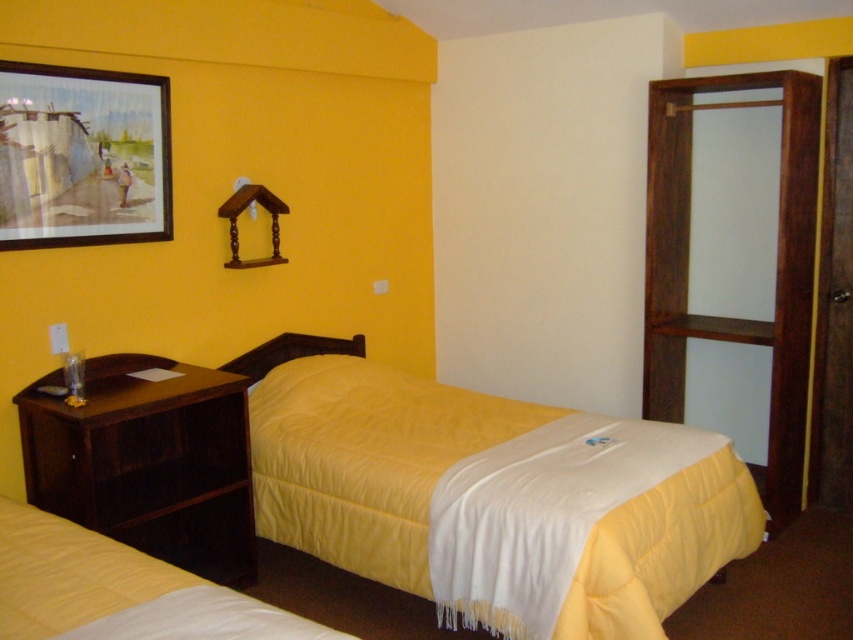
Is dark wood dresser at lower left thinner than wooden wardrobe at right?

In fact, dark wood dresser at lower left might be wider than wooden wardrobe at right.

Who is positioned more to the left, dark wood dresser at lower left or wooden wardrobe at right?

Positioned to the left is dark wood dresser at lower left.

The image size is (853, 640). What do you see at coordinates (148, 461) in the screenshot?
I see `dark wood dresser at lower left` at bounding box center [148, 461].

Locate an element on the screen. The height and width of the screenshot is (640, 853). dark wood dresser at lower left is located at coordinates (148, 461).

Is yellow fabric bed at center in front of dark wood dresser at lower left?

That is True.

Does yellow fabric bed at center appear on the left side of dark wood dresser at lower left?

No, yellow fabric bed at center is not to the left of dark wood dresser at lower left.

Is point (519, 554) positioned after point (247, 531)?

No.

The width and height of the screenshot is (853, 640). Identify the location of yellow fabric bed at center. (490, 493).

Can you confirm if dark wood dresser at lower left is smaller than wooden framed painting at upper left?

No.

Who is positioned more to the left, dark wood dresser at lower left or wooden framed painting at upper left?

wooden framed painting at upper left

Who is more forward, (122, 540) or (143, 93)?

Point (122, 540) is in front.

I want to click on dark wood dresser at lower left, so click(148, 461).